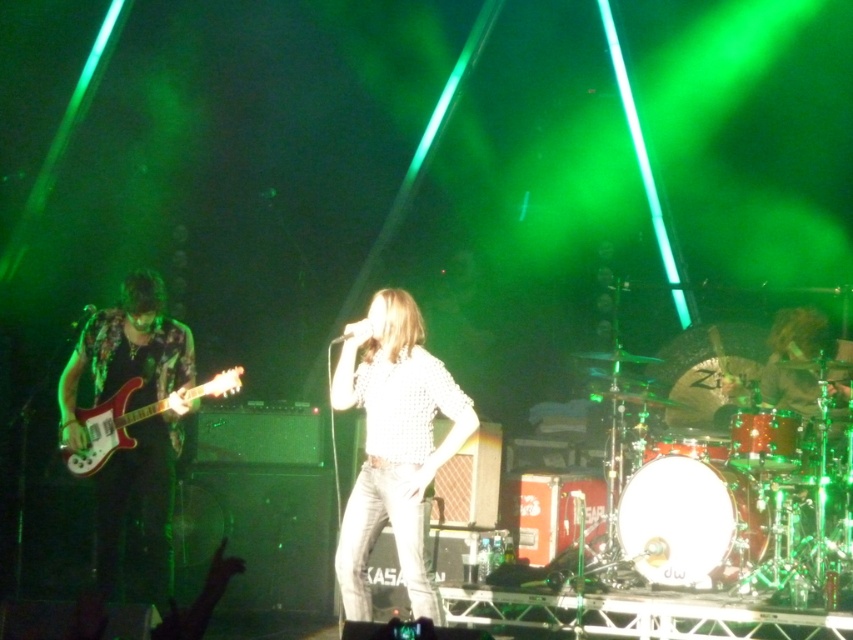
Question: Which of the following is the farthest from the observer?

Choices:
 (A) (793, 349)
 (B) (136, 412)

Answer: (A)

Question: Is shiny gold drum set at right to the right of shiny red electric guitar at left from the viewer's perspective?

Choices:
 (A) no
 (B) yes

Answer: (B)

Question: Does white textured shirt at center lie in front of shiny gold drum set at right?

Choices:
 (A) no
 (B) yes

Answer: (B)

Question: Which object is the closest to the shiny metallic guitar at left?

Choices:
 (A) shiny gold drum set at right
 (B) shiny red electric guitar at left

Answer: (B)

Question: Estimate the real-world distances between objects in this image. Which object is closer to the white textured shirt at center?

Choices:
 (A) shiny metallic guitar at left
 (B) shiny gold drum set at right

Answer: (A)

Question: Where is shiny metallic guitar at left located in relation to shiny gold drum set at right in the image?

Choices:
 (A) right
 (B) left

Answer: (B)